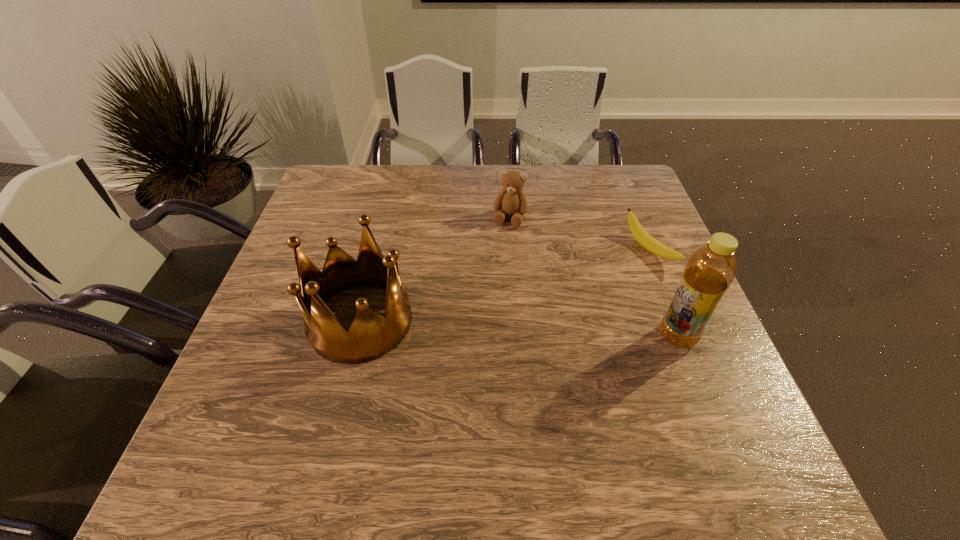
I want to click on free area in between the shortest object and the third shortest object, so click(x=505, y=285).

This screenshot has width=960, height=540. In order to click on free spot between the banana and the teddy bear in this screenshot , I will do `click(580, 234)`.

The height and width of the screenshot is (540, 960). In order to click on free space between the shortest object and the bottle in this screenshot , I will do point(663,293).

What are the coordinates of `unoccupied position between the third shortest object and the tallest object` in the screenshot? It's located at (518, 329).

Find the location of `object that is the second closest one to the leftmost object`. object that is the second closest one to the leftmost object is located at coordinates (710, 270).

Identify the location of object that is the second closest to the banana. (511, 200).

Where is `free point that satisfies the following two spatial constraints: 1. on the front side of the second tallest object; 2. on the right side of the bottle`? free point that satisfies the following two spatial constraints: 1. on the front side of the second tallest object; 2. on the right side of the bottle is located at coordinates (356, 336).

Find the location of a particular element. vacant position in the image that satisfies the following two spatial constraints: 1. on the back side of the banana; 2. on the left side of the tallest object is located at coordinates (643, 250).